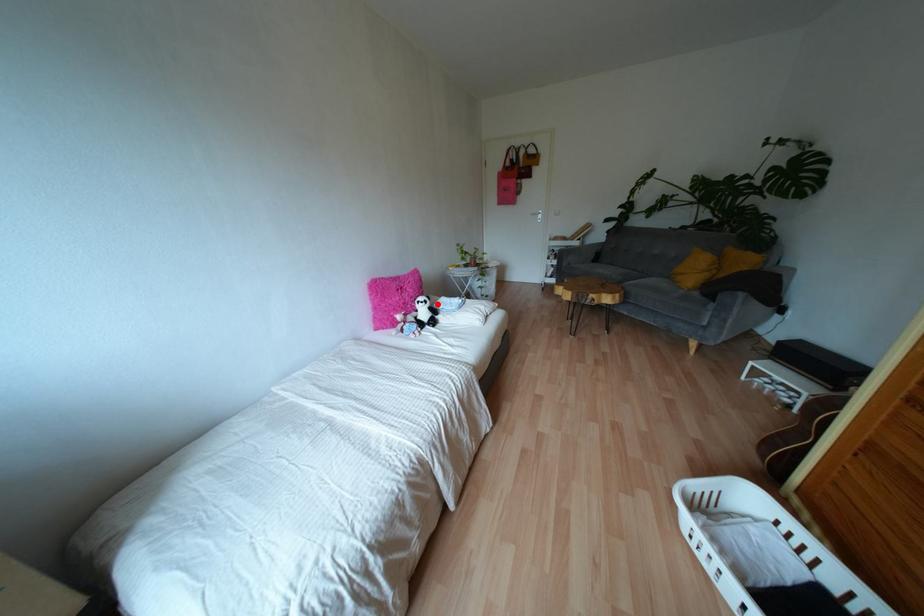
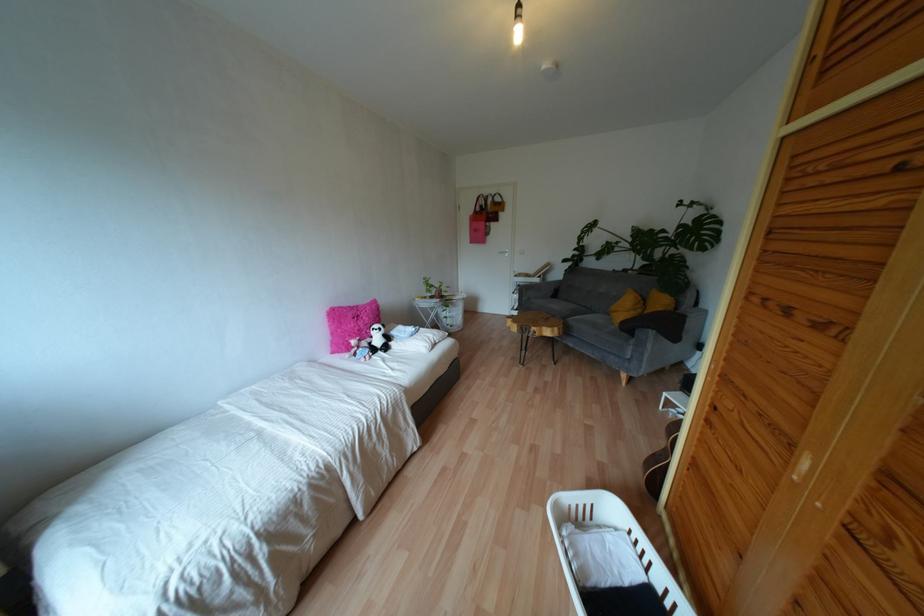
In the second image, find the point that corresponds to the highlighted location in the first image.

(393, 331)